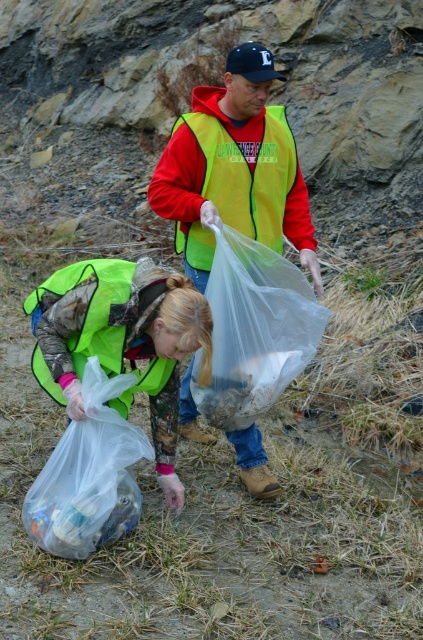
You are a hiker trying to navigate between the transparent plastic bag at center and the matte red jacket at center. Which object should you avoid stepping on to prevent slipping?

The transparent plastic bag at center might be wider than the matte red jacket at center, so stepping on the transparent plastic bag at center could be riskier due to its potential slipperiness compared to the matte red jacket at center.

In the scene where two people are cleaning outdoors on a rocky hillside, there is a person in a bright yellow green safety vest over a red hoodie and another person represented by the point at (121, 340). Which of these two people is wearing the matte green vest at lower left?

The person represented by the point at (121, 340) is wearing the matte green vest at lower left.